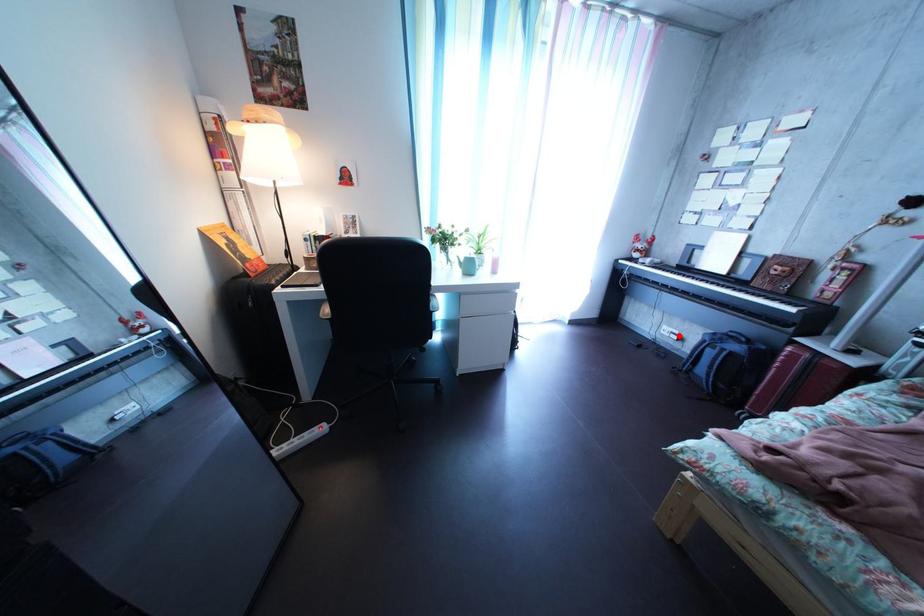
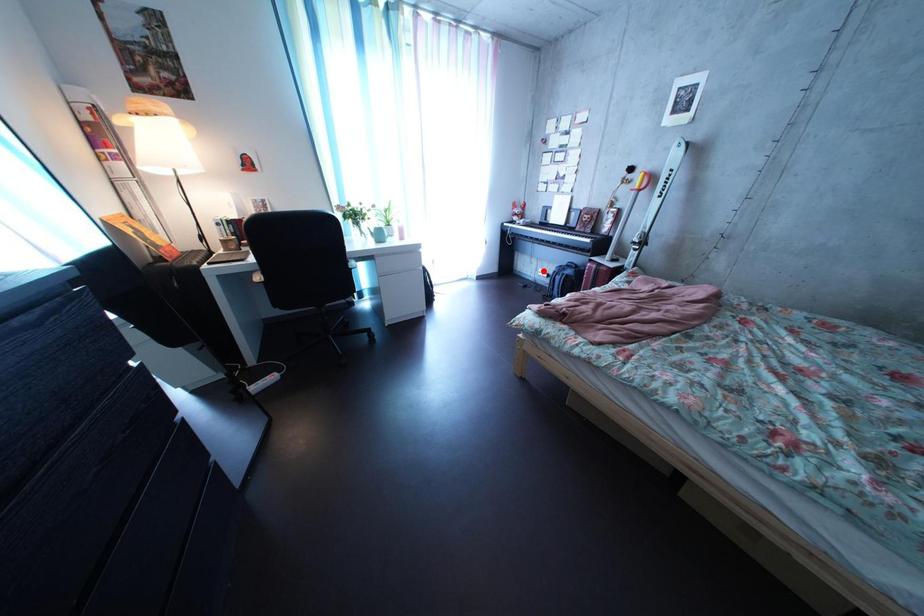
I am providing you with two images of the same scene from different viewpoints. A red point is marked on the first image and another point is marked on the second image. Are the points marked in image1 and image2 representing the same 3D position?

No